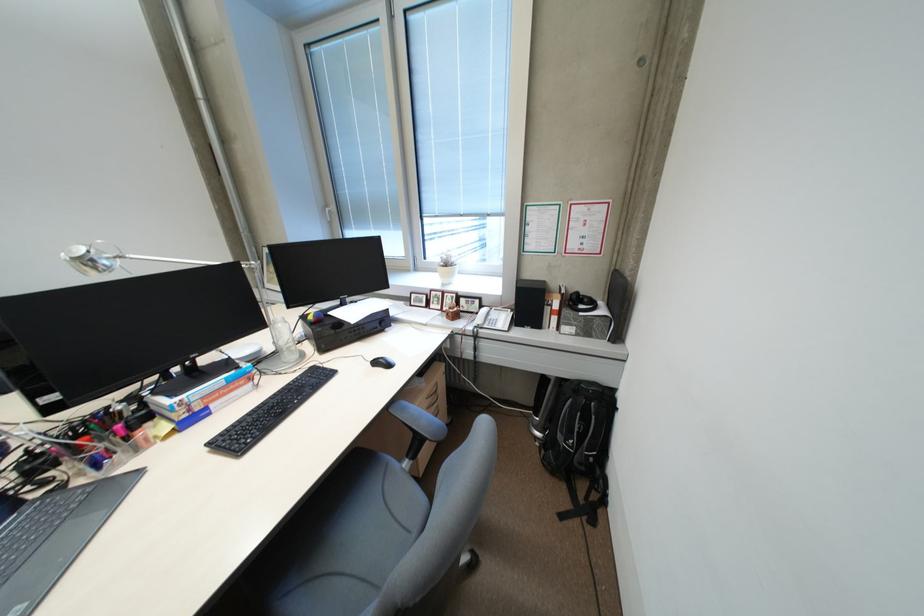
What do you see at coordinates (529, 302) in the screenshot? The width and height of the screenshot is (924, 616). I see `a black speaker` at bounding box center [529, 302].